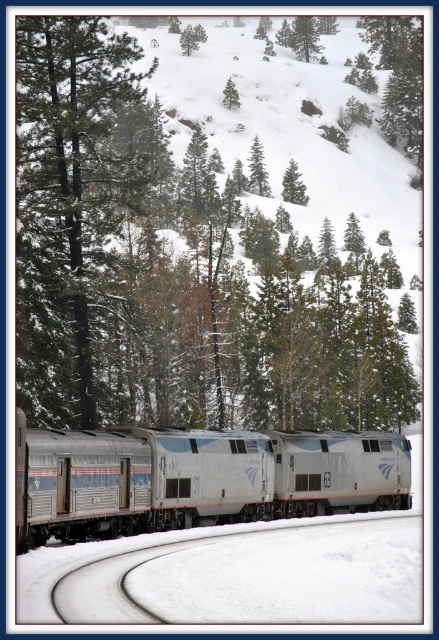
You are an observer standing on the train tracks and looking towards the forest. You see a green matte tree at center and a green matte tree at upper center. Which tree is closer to your right side?

The green matte tree at center is positioned on the right side of green matte tree at upper center, so it is closer to your right side.

You are a photographer planning to capture the winter landscape with the train in the background. You have a camera with a 50mm lens that can focus on objects up to 10 meters away. The smooth dark green tree at left and the green matte tree at upper center are both within your field of view. Which tree should you focus on to ensure it appears sharp in the photo?

The smooth dark green tree at left is closer to you than the green matte tree at upper center, so focusing on it will ensure it appears sharp since it is within the 10m focus range. The distant tree may be beyond the lens range and appear blurry.